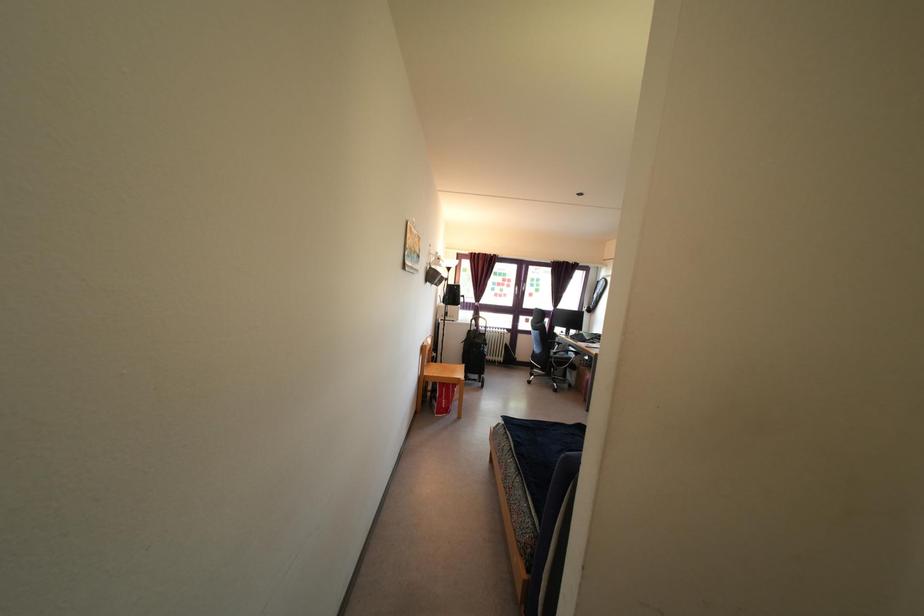
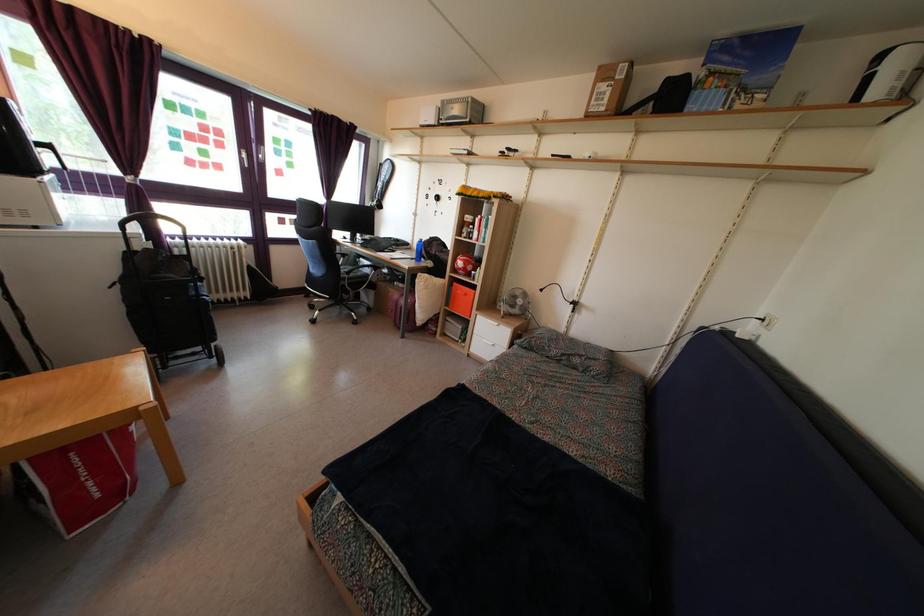
Find the pixel in the second image that matches [562,352] in the first image.

(346, 264)